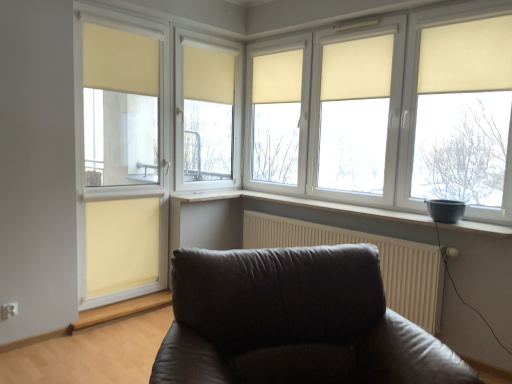
Question: Is white textured radiator at lower right at the left side of translucent beige glass door at left?

Choices:
 (A) no
 (B) yes

Answer: (A)

Question: From the image's perspective, is white textured radiator at lower right above translucent beige glass door at left?

Choices:
 (A) yes
 (B) no

Answer: (B)

Question: Is white textured radiator at lower right smaller than translucent beige glass door at left?

Choices:
 (A) no
 (B) yes

Answer: (B)

Question: Is white textured radiator at lower right beside translucent beige glass door at left?

Choices:
 (A) yes
 (B) no

Answer: (B)

Question: Would you consider white textured radiator at lower right to be distant from translucent beige glass door at left?

Choices:
 (A) no
 (B) yes

Answer: (B)

Question: Is beige fabric curtain at center, acting as the 4th curtain starting from the left, inside or outside of beige fabric curtain at upper right, which is the sixth curtain from left to right?

Choices:
 (A) outside
 (B) inside

Answer: (A)

Question: From their relative heights in the image, would you say beige fabric curtain at center, acting as the third curtain starting from the right, is taller or shorter than beige fabric curtain at upper right, which is the sixth curtain from left to right?

Choices:
 (A) short
 (B) tall

Answer: (B)

Question: Visually, is beige fabric curtain at center, acting as the third curtain starting from the right, positioned to the left or to the right of beige fabric curtain at upper right, which is counted as the first curtain, starting from the right?

Choices:
 (A) right
 (B) left

Answer: (B)

Question: From a real-world perspective, is beige fabric curtain at center, acting as the third curtain starting from the right, positioned above or below beige fabric curtain at upper right, which is counted as the first curtain, starting from the right?

Choices:
 (A) below
 (B) above

Answer: (A)

Question: Relative to beige fabric curtain at upper left, arranged as the second curtain when viewed from the left, is translucent beige glass door at left in front or behind?

Choices:
 (A) front
 (B) behind

Answer: (A)

Question: Based on their positions, is translucent beige glass door at left located to the left or right of beige fabric curtain at upper left, arranged as the 5th curtain when viewed from the right?

Choices:
 (A) left
 (B) right

Answer: (A)

Question: Considering the positions of translucent beige glass door at left and beige fabric curtain at upper left, arranged as the second curtain when viewed from the left, in the image, is translucent beige glass door at left wider or thinner than beige fabric curtain at upper left, arranged as the second curtain when viewed from the left,?

Choices:
 (A) thin
 (B) wide

Answer: (B)

Question: From the image's perspective, is translucent beige glass door at left located above or below beige fabric curtain at upper left, arranged as the second curtain when viewed from the left?

Choices:
 (A) above
 (B) below

Answer: (B)

Question: Is white matte window sill at center spatially inside beige fabric curtain at lower left, arranged as the 1th curtain when viewed from the left, or outside of it?

Choices:
 (A) outside
 (B) inside

Answer: (A)

Question: In the image, is white matte window sill at center positioned in front of or behind beige fabric curtain at lower left, the 6th curtain when ordered from right to left?

Choices:
 (A) behind
 (B) front

Answer: (B)